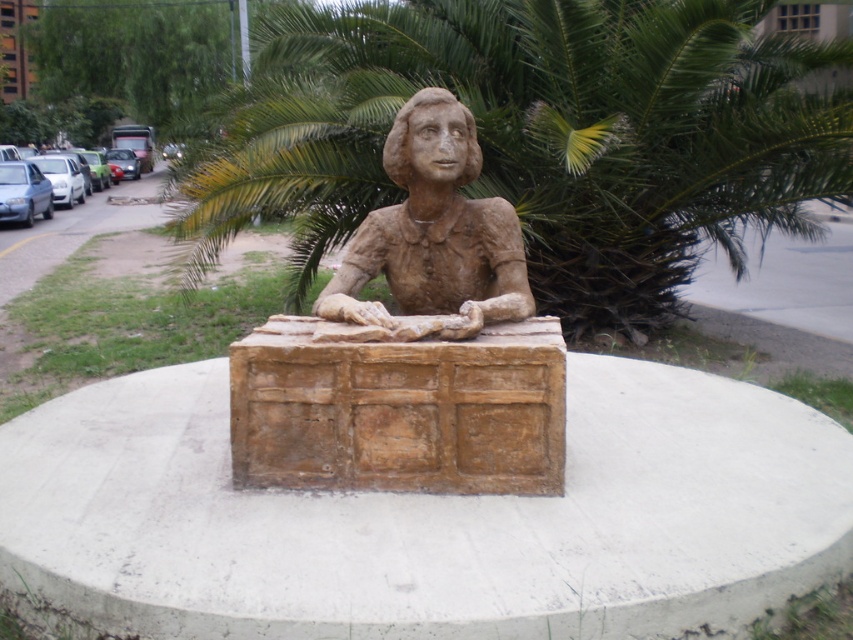
You are a delivery person trying to place a small package on the brown textured cement at center near the brown clay bust at center. Can you fit the package between them?

The brown textured cement at center might be wider than brown clay bust at center, so there might be enough space to place the small package between them.

You are a city planner reviewing this public space. You need to determine if the green leafy palm tree at center can be moved closer to the brown textured cement at center without blocking the sculpture. Based on their sizes, is this feasible?

The brown textured cement at center is bigger than the green leafy palm tree at center. Since the cement is larger, moving the palm tree closer might still be possible as long as there is enough space around the cement to accommodate the tree without obstruction.

You are a photographer standing in front of the bronze sculpture of a seated figure. You want to capture a photo that includes both the sculpture and the green leafy palm tree at center. Given that your camera can focus on objects up to 6 meters away, will the palm tree be in focus?

The distance of the green leafy palm tree at center from the camera is 6.68 meters, which exceeds the camera focus limit of 6 meters. Therefore, the palm tree will not be in focus.